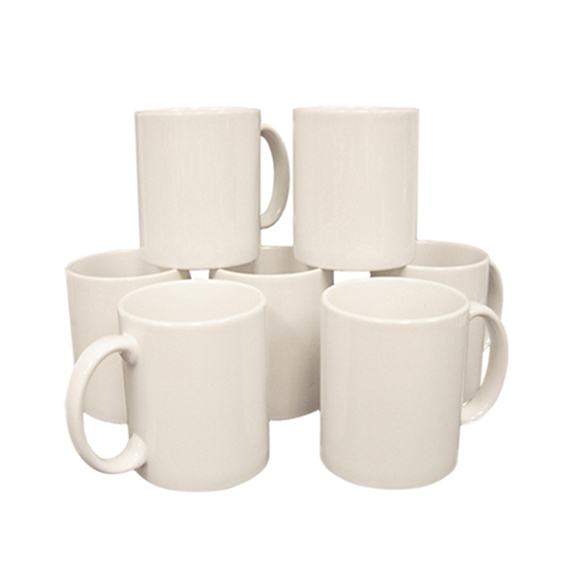
Find the location of a particular element. Image resolution: width=570 pixels, height=570 pixels. ceramic mug handles is located at coordinates (101, 347), (495, 329), (491, 299), (278, 156).